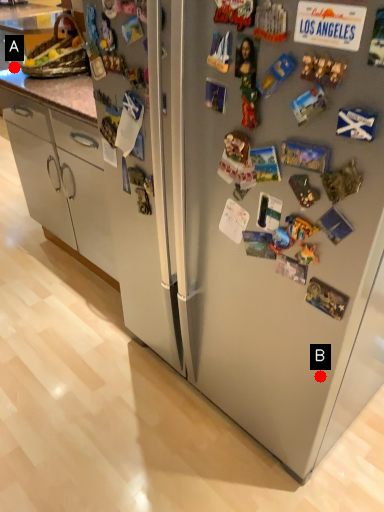
Question: Two points are circled on the image, labeled by A and B beside each circle. Which point is closer to the camera taking this photo?

Choices:
 (A) A is closer
 (B) B is closer

Answer: (B)